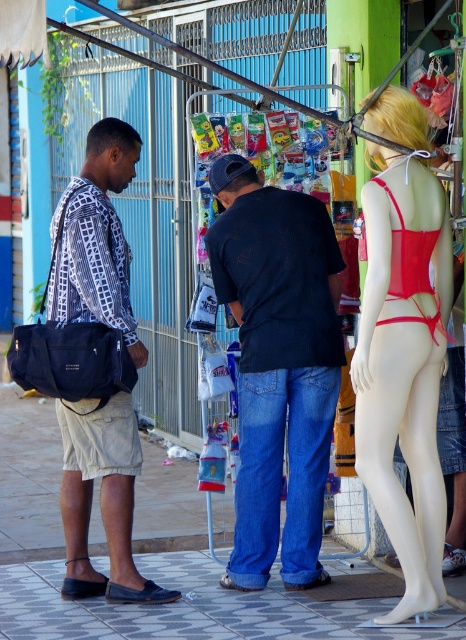
You are standing at point (405, 259) and want to walk to point (41, 625). Given that there is a metal canopy supported by poles between them, will you be able to walk directly to your destination without any obstacles?

Point (41, 625) is behind point (405, 259), so you will not be able to walk directly to your destination without obstacles because the metal canopy and poles are in between.

You are standing at the point marked by coordinates point (187, 609). Looking around, what surface are you standing on?

You are standing on the gray tile pavement at lower center, as the coordinates point (187, 609) corresponds to this surface.